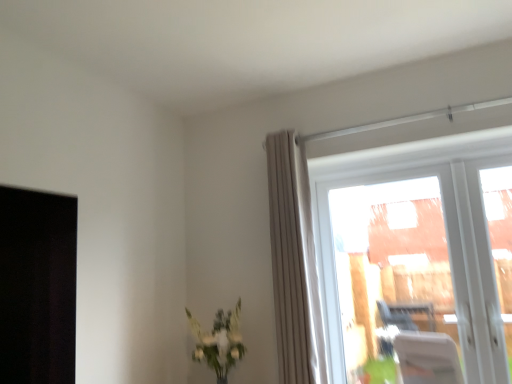
Question: Is green leafy plant at lower center at the left side of beige textured curtain at upper right?

Choices:
 (A) yes
 (B) no

Answer: (A)

Question: Is beige textured curtain at upper right at the back of green leafy plant at lower center?

Choices:
 (A) yes
 (B) no

Answer: (B)

Question: Is green leafy plant at lower center to the right of beige textured curtain at upper right from the viewer's perspective?

Choices:
 (A) no
 (B) yes

Answer: (A)

Question: From a real-world perspective, is green leafy plant at lower center under beige textured curtain at upper right?

Choices:
 (A) no
 (B) yes

Answer: (B)

Question: Considering the relative sizes of green leafy plant at lower center and beige textured curtain at upper right in the image provided, is green leafy plant at lower center thinner than beige textured curtain at upper right?

Choices:
 (A) yes
 (B) no

Answer: (B)

Question: From a real-world perspective, is green leafy plant at lower center above or below beige textured curtain at upper right?

Choices:
 (A) above
 (B) below

Answer: (B)

Question: Based on their sizes in the image, would you say green leafy plant at lower center is bigger or smaller than beige textured curtain at upper right?

Choices:
 (A) big
 (B) small

Answer: (B)

Question: Which is correct: green leafy plant at lower center is inside beige textured curtain at upper right, or outside of it?

Choices:
 (A) inside
 (B) outside

Answer: (B)

Question: Considering the positions of point (210, 362) and point (323, 349), is point (210, 362) closer or farther from the camera than point (323, 349)?

Choices:
 (A) farther
 (B) closer

Answer: (B)

Question: Choose the correct answer: Is green leafy plant at lower center inside transparent glass window at upper right or outside it?

Choices:
 (A) inside
 (B) outside

Answer: (B)

Question: Is green leafy plant at lower center to the left or to the right of transparent glass window at upper right in the image?

Choices:
 (A) right
 (B) left

Answer: (B)

Question: Is green leafy plant at lower center wider or thinner than transparent glass window at upper right?

Choices:
 (A) thin
 (B) wide

Answer: (B)

Question: From their relative heights in the image, would you say green leafy plant at lower center is taller or shorter than transparent glass window at upper right?

Choices:
 (A) tall
 (B) short

Answer: (B)

Question: In terms of height, does transparent glass window at upper right look taller or shorter compared to green leafy plant at lower center?

Choices:
 (A) tall
 (B) short

Answer: (A)

Question: From a real-world perspective, is transparent glass window at upper right positioned above or below green leafy plant at lower center?

Choices:
 (A) below
 (B) above

Answer: (B)